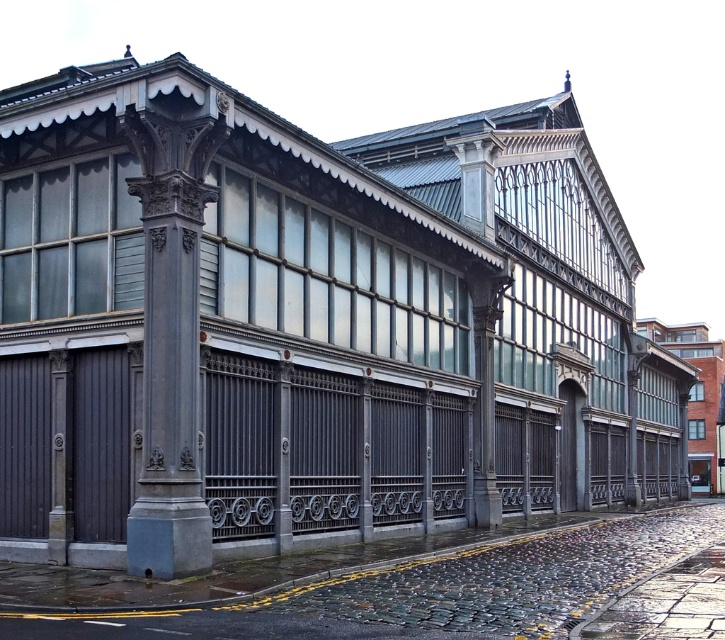
Does cobblestone pavement at lower center appear under slate gray stone column at left?

Correct, cobblestone pavement at lower center is located below slate gray stone column at left.

Between point (484, 620) and point (130, 129), which one is positioned behind?

The point (130, 129) is behind.

Does point (580, 541) lie in front of point (144, 483)?

No.

Where is `cobblestone pavement at lower center`? cobblestone pavement at lower center is located at coordinates (410, 586).